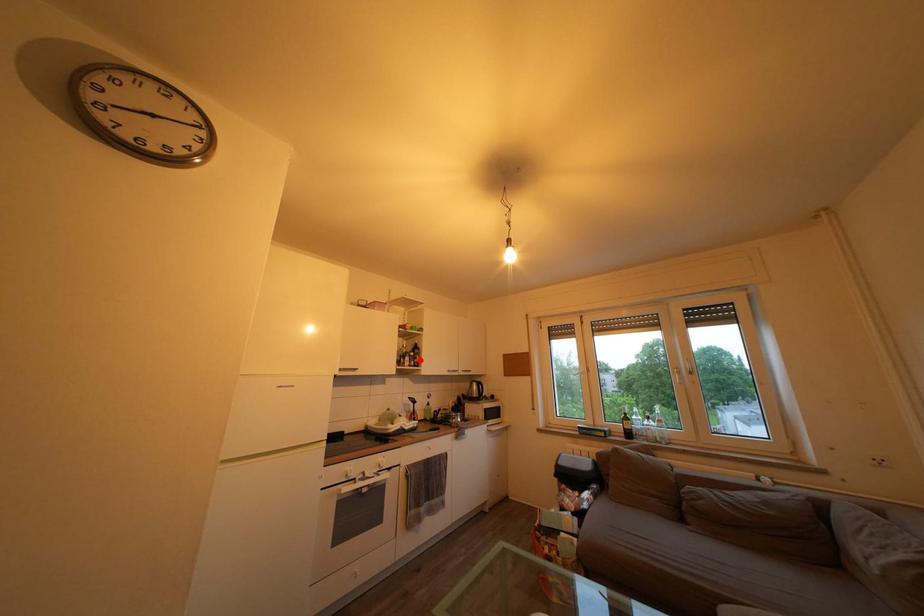
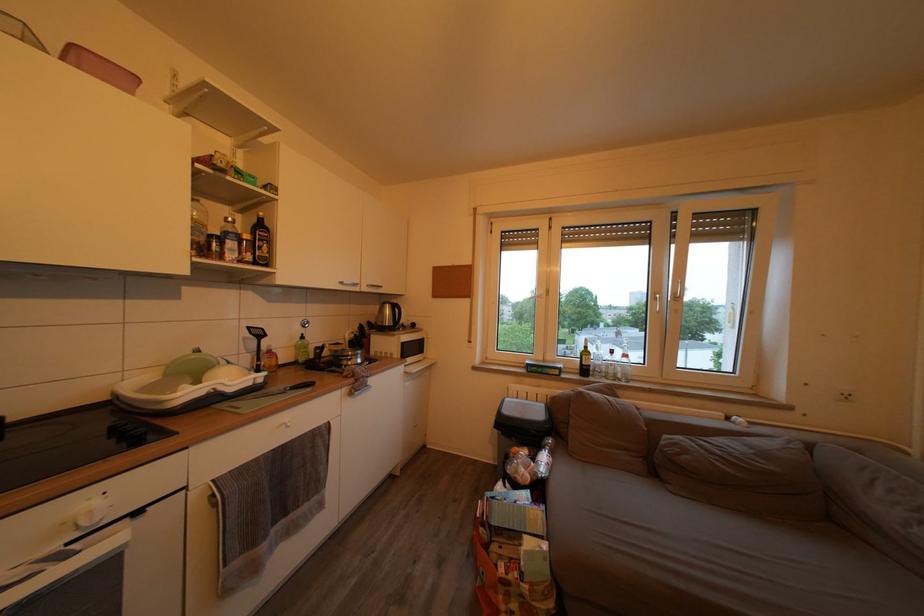
Locate, in the second image, the point that corresponds to the highlighted location in the first image.

(253, 243)